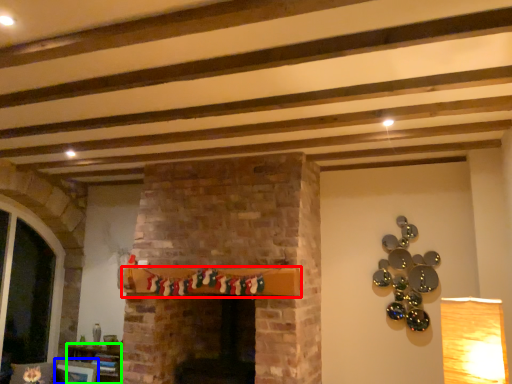
Question: Which is farther away from shelf (highlighted by a red box)? picture frame (highlighted by a blue box) or furniture (highlighted by a green box)?

Choices:
 (A) picture frame
 (B) furniture

Answer: (A)